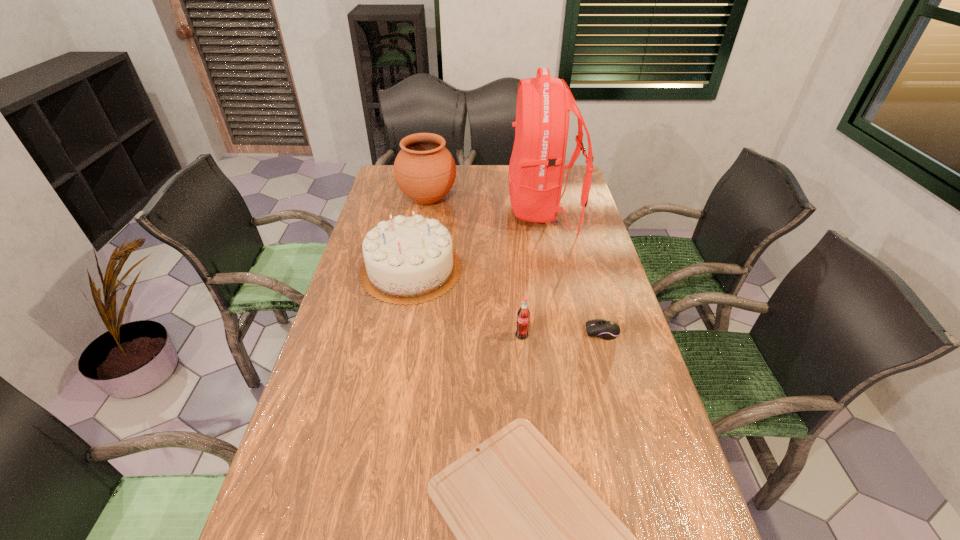
Locate an element on the screen. The image size is (960, 540). the tallest object is located at coordinates coord(537,164).

This screenshot has width=960, height=540. What are the coordinates of `the fifth shortest object` in the screenshot? It's located at (425, 171).

Find the location of a particular element. the fourth shortest object is located at coordinates (407, 260).

Locate an element on the screen. the fourth tallest object is located at coordinates (523, 316).

Where is `the fifth tallest object`? the fifth tallest object is located at coordinates (606, 329).

The height and width of the screenshot is (540, 960). In order to click on vacant space located on the main compartment of the tallest object in this screenshot , I will do [x=468, y=210].

The width and height of the screenshot is (960, 540). In order to click on vacant region located on the main compartment of the tallest object in this screenshot , I will do `click(444, 210)`.

The height and width of the screenshot is (540, 960). What are the coordinates of `vacant space located 0.250m on the main compartment of the tallest object` in the screenshot? It's located at 444,210.

Locate an element on the screen. The height and width of the screenshot is (540, 960). vacant space located on the front of the second tallest object is located at coordinates (417, 266).

You are a GUI agent. You are given a task and a screenshot of the screen. Output one action in this format:
    pyautogui.click(x=<x>, y=<y>)
    Task: Click on the free space located on the right of the birthday cake
    The image size is (960, 540).
    Given the screenshot: What is the action you would take?
    point(576,269)